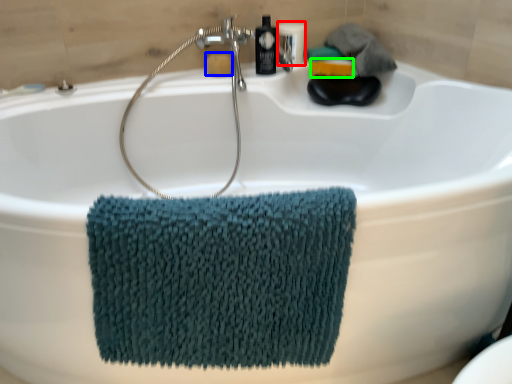
Question: Which object is the farthest from toiletry (highlighted by a red box)? Choose among these: soap (highlighted by a blue box) or soap (highlighted by a green box).

Choices:
 (A) soap
 (B) soap

Answer: (A)